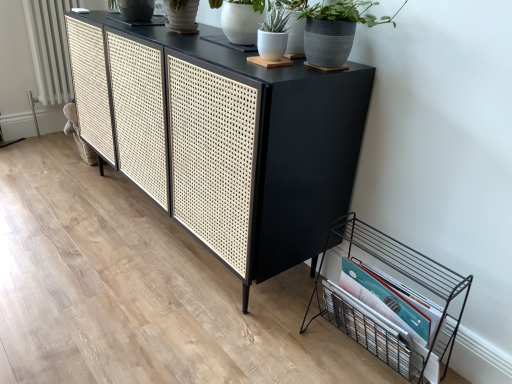
Locate an element on the screen. This screenshot has height=384, width=512. gray matte pot at upper right, acting as the second houseplant starting from the left is located at coordinates (333, 28).

Describe the element at coordinates (333, 28) in the screenshot. I see `gray matte pot at upper right, which is the 1th houseplant from right to left` at that location.

The image size is (512, 384). Describe the element at coordinates (50, 48) in the screenshot. I see `white textured radiator at left` at that location.

Image resolution: width=512 pixels, height=384 pixels. What are the coordinates of `black wire magazine rack at lower right` in the screenshot? It's located at (391, 300).

Find the location of a particular element. The height and width of the screenshot is (384, 512). black woven cane cabinet at center is located at coordinates (227, 141).

Where is `gray matte pot at upper right, acting as the second houseplant starting from the left`? gray matte pot at upper right, acting as the second houseplant starting from the left is located at coordinates (333, 28).

Is white ceramic pot at upper center positioned with its back to black woven cane cabinet at center?

No, white ceramic pot at upper center's orientation is not away from black woven cane cabinet at center.

From the picture: Considering the sizes of objects white ceramic pot at upper center and black woven cane cabinet at center in the image provided, who is smaller, white ceramic pot at upper center or black woven cane cabinet at center?

With smaller size is white ceramic pot at upper center.

Is white ceramic pot at upper center wider or thinner than black woven cane cabinet at center?

Considering their sizes, white ceramic pot at upper center looks slimmer than black woven cane cabinet at center.

Is white ceramic pot at upper center not close to black woven cane cabinet at center?

No.

Between point (277, 45) and point (233, 5), which one is positioned in front?

Point (277, 45)

In the scene shown: From a real-world perspective, is white matte pot at upper center, which is the second houseplant from right to left, above or below white ceramic pot at upper center?

From a real-world perspective, white matte pot at upper center, which is the second houseplant from right to left, is physically above white ceramic pot at upper center.

Considering the relative sizes of white matte pot at upper center, which is the second houseplant from right to left, and white ceramic pot at upper center in the image provided, is white matte pot at upper center, which is the second houseplant from right to left, thinner than white ceramic pot at upper center?

Yes, white matte pot at upper center, which is the second houseplant from right to left, is thinner than white ceramic pot at upper center.

Looking at this image, is there a large distance between white matte pot at upper center, acting as the 1th houseplant starting from the left, and white ceramic pot at upper center?

No, there isn't a large distance between white matte pot at upper center, acting as the 1th houseplant starting from the left, and white ceramic pot at upper center.

From the image's perspective, which one is positioned lower, white textured radiator at left or white ceramic pot at upper center?

From the image's view, white ceramic pot at upper center is below.

Considering the relative positions of white textured radiator at left and white ceramic pot at upper center in the image provided, is white textured radiator at left behind white ceramic pot at upper center?

Yes, it is behind white ceramic pot at upper center.

How many degrees apart are the facing directions of white textured radiator at left and white ceramic pot at upper center?

92.4 degrees separate the facing orientations of white textured radiator at left and white ceramic pot at upper center.

Are white textured radiator at left and white ceramic pot at upper center making contact?

No, white textured radiator at left is not in contact with white ceramic pot at upper center.

Are black woven cane cabinet at center and black wire magazine rack at lower right making contact?

black woven cane cabinet at center is not next to black wire magazine rack at lower right, and they're not touching.

Is black woven cane cabinet at center looking in the opposite direction of black wire magazine rack at lower right?

black woven cane cabinet at center is not turned away from black wire magazine rack at lower right.

From a real-world perspective, between black woven cane cabinet at center and black wire magazine rack at lower right, who is vertically lower?

black wire magazine rack at lower right, from a real-world perspective.

Considering the relative sizes of black woven cane cabinet at center and black wire magazine rack at lower right in the image provided, is black woven cane cabinet at center thinner than black wire magazine rack at lower right?

In fact, black woven cane cabinet at center might be wider than black wire magazine rack at lower right.

Is gray matte pot at upper right, acting as the second houseplant starting from the left, positioned with its back to white matte pot at upper center, which is the second houseplant from right to left?

No, gray matte pot at upper right, acting as the second houseplant starting from the left,'s orientation is not away from white matte pot at upper center, which is the second houseplant from right to left.

From the image's perspective, is gray matte pot at upper right, acting as the second houseplant starting from the left, located above white matte pot at upper center, which is the second houseplant from right to left?

No, from the image's perspective, gray matte pot at upper right, acting as the second houseplant starting from the left, is not over white matte pot at upper center, which is the second houseplant from right to left.

Is gray matte pot at upper right, acting as the second houseplant starting from the left, touching white matte pot at upper center, acting as the 1th houseplant starting from the left?

Yes, gray matte pot at upper right, acting as the second houseplant starting from the left, is with white matte pot at upper center, acting as the 1th houseplant starting from the left.

Between gray matte pot at upper right, which is the 1th houseplant from right to left, and white matte pot at upper center, which is the second houseplant from right to left, which one has less height?

white matte pot at upper center, which is the second houseplant from right to left, is shorter.

How distant is white ceramic pot at upper center from gray matte pot at upper right, acting as the second houseplant starting from the left?

white ceramic pot at upper center is 9.65 inches away from gray matte pot at upper right, acting as the second houseplant starting from the left.

Is point (248, 37) closer or farther from the camera than point (332, 41)?

Point (248, 37) is farther from the camera than point (332, 41).

Considering the relative positions of white ceramic pot at upper center and gray matte pot at upper right, which is the 1th houseplant from right to left, in the image provided, is white ceramic pot at upper center to the left of gray matte pot at upper right, which is the 1th houseplant from right to left, from the viewer's perspective?

Indeed, white ceramic pot at upper center is positioned on the left side of gray matte pot at upper right, which is the 1th houseplant from right to left.

Considering the positions of objects white ceramic pot at upper center and gray matte pot at upper right, acting as the second houseplant starting from the left, in the image provided, who is in front, white ceramic pot at upper center or gray matte pot at upper right, acting as the second houseplant starting from the left,?

gray matte pot at upper right, acting as the second houseplant starting from the left, is more forward.

Is black woven cane cabinet at center completely or partially outside of white ceramic pot at upper center?

That's correct, black woven cane cabinet at center is outside of white ceramic pot at upper center.

From their relative heights in the image, would you say black woven cane cabinet at center is taller or shorter than white ceramic pot at upper center?

Clearly, black woven cane cabinet at center is taller compared to white ceramic pot at upper center.

Does black woven cane cabinet at center have a larger size compared to white ceramic pot at upper center?

Yes.

Is black woven cane cabinet at center far from white ceramic pot at upper center?

No, black woven cane cabinet at center is not far away from white ceramic pot at upper center.

Where is `flowerpot to the right of black woven cane cabinet at center`? The width and height of the screenshot is (512, 384). flowerpot to the right of black woven cane cabinet at center is located at coordinates (242, 20).

Locate an element on the screen. This screenshot has width=512, height=384. flowerpot below the white matte pot at upper center, which is the second houseplant from right to left (from a real-world perspective) is located at coordinates (242, 20).

Looking at the image, which one is located further to black woven cane cabinet at center, gray matte pot at upper right, acting as the second houseplant starting from the left, or white textured radiator at left?

white textured radiator at left lies further to black woven cane cabinet at center than the other object.

Looking at the image, which one is located further to white textured radiator at left, white matte pot at upper center, acting as the 1th houseplant starting from the left, or black wire magazine rack at lower right?

The object further to white textured radiator at left is black wire magazine rack at lower right.

From the image, which object appears to be farther from white matte pot at upper center, acting as the 1th houseplant starting from the left, white textured radiator at left or gray matte pot at upper right, acting as the second houseplant starting from the left?

white textured radiator at left is positioned further to the anchor white matte pot at upper center, acting as the 1th houseplant starting from the left.

When comparing their distances from gray matte pot at upper right, acting as the second houseplant starting from the left, does white ceramic pot at upper center or white textured radiator at left seem closer?

white ceramic pot at upper center is closer to gray matte pot at upper right, acting as the second houseplant starting from the left.

Looking at the image, which one is located further to gray matte pot at upper right, which is the 1th houseplant from right to left, black woven cane cabinet at center or black wire magazine rack at lower right?

black wire magazine rack at lower right is positioned further to the anchor gray matte pot at upper right, which is the 1th houseplant from right to left.

Which object lies nearer to the anchor point gray matte pot at upper right, which is the 1th houseplant from right to left, white textured radiator at left or white matte pot at upper center, acting as the 1th houseplant starting from the left?

Among the two, white matte pot at upper center, acting as the 1th houseplant starting from the left, is located nearer to gray matte pot at upper right, which is the 1th houseplant from right to left.

Which object lies further to the anchor point black woven cane cabinet at center, white matte pot at upper center, which is the second houseplant from right to left, or white ceramic pot at upper center?

white matte pot at upper center, which is the second houseplant from right to left.

Considering their positions, is black woven cane cabinet at center positioned further to white textured radiator at left than white ceramic pot at upper center?

white ceramic pot at upper center lies further to white textured radiator at left than the other object.

Identify the location of flowerpot between black woven cane cabinet at center and gray matte pot at upper right, acting as the second houseplant starting from the left. pyautogui.click(x=242, y=20).

Where is `table between gray matte pot at upper right, which is the 1th houseplant from right to left, and black wire magazine rack at lower right, in the vertical direction`? The image size is (512, 384). table between gray matte pot at upper right, which is the 1th houseplant from right to left, and black wire magazine rack at lower right, in the vertical direction is located at coordinates (227, 141).

The image size is (512, 384). In order to click on houseplant situated between white textured radiator at left and gray matte pot at upper right, which is the 1th houseplant from right to left, from left to right in this screenshot , I will do `click(281, 31)`.

The image size is (512, 384). In order to click on houseplant between white matte pot at upper center, which is the second houseplant from right to left, and black wire magazine rack at lower right, in the vertical direction in this screenshot , I will do `click(333, 28)`.